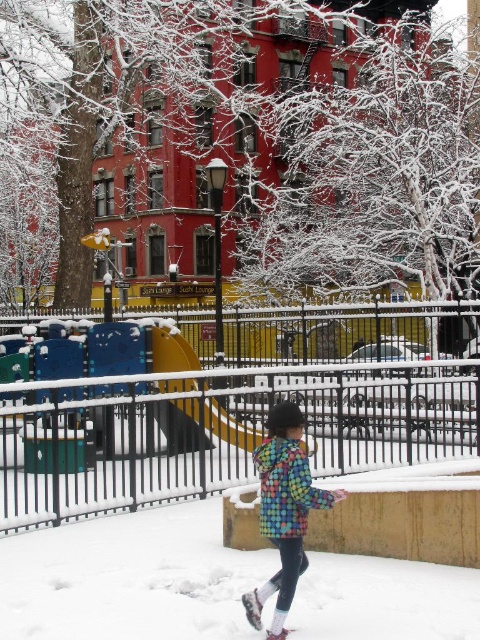
Question: Is metallic black fence at center above multicolored quilted jacket at center?

Choices:
 (A) yes
 (B) no

Answer: (A)

Question: Is metallic black fence at center thinner than multicolored quilted jacket at center?

Choices:
 (A) no
 (B) yes

Answer: (A)

Question: Which object appears closest to the camera in this image?

Choices:
 (A) multicolored quilted jacket at center
 (B) yellow plastic slide at center
 (C) metallic black fence at center

Answer: (A)

Question: Among these points, which one is nearest to the camera?

Choices:
 (A) (208, 419)
 (B) (206, 381)
 (C) (256, 624)

Answer: (C)

Question: Does metallic black fence at center have a greater width compared to multicolored quilted jacket at center?

Choices:
 (A) yes
 (B) no

Answer: (A)

Question: Which object appears closest to the camera in this image?

Choices:
 (A) metallic black fence at center
 (B) multicolored quilted jacket at center
 (C) yellow plastic slide at center

Answer: (B)